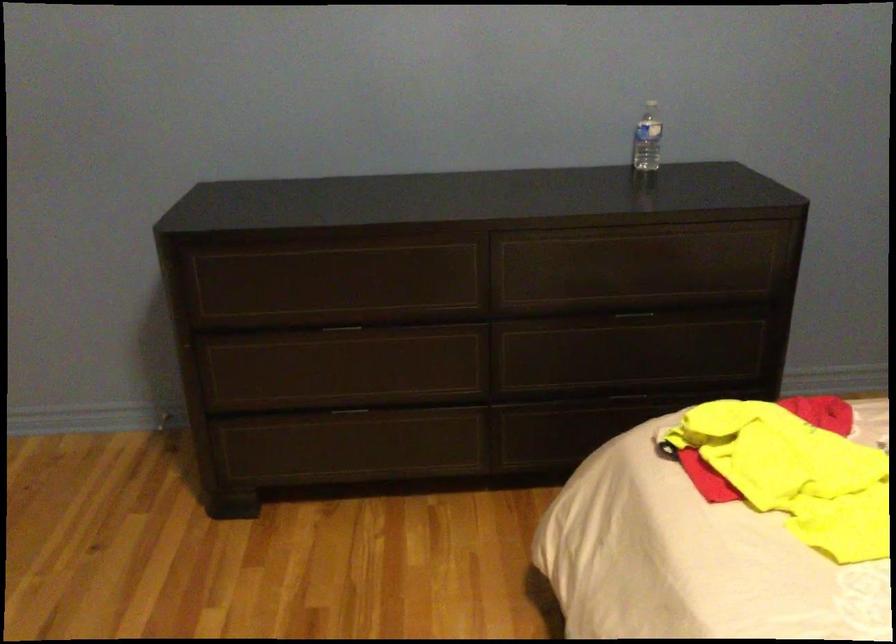
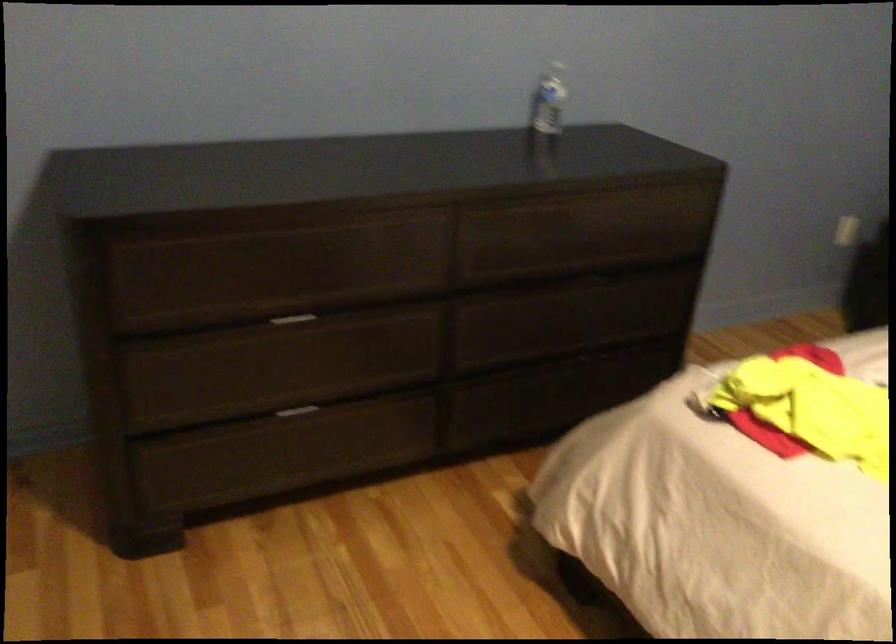
Locate, in the second image, the point that corresponds to (x=642, y=140) in the first image.

(548, 100)